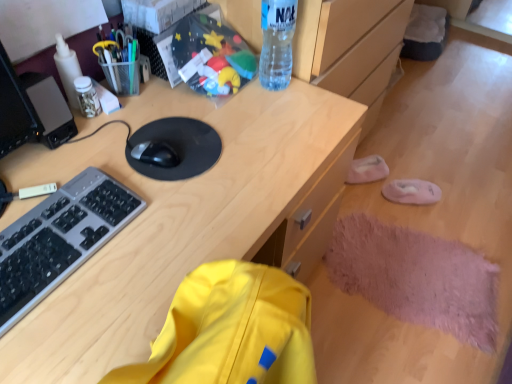
Locate an element on the screen. free space between black matte mousepad at center and metallic pen holder at upper left, the second stationery viewed from the left is located at coordinates tap(146, 112).